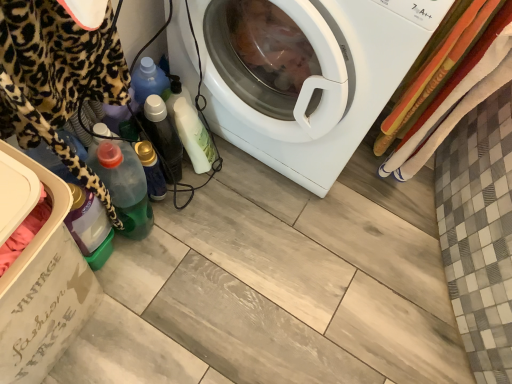
Question: Does translucent plastic bottle at lower left, arranged as the third bottle when viewed from the top, have a smaller size compared to transparent plastic dish washer at lower left?

Choices:
 (A) no
 (B) yes

Answer: (B)

Question: Can you confirm if translucent plastic bottle at lower left, which is the first bottle in bottom-to-top order, is shorter than transparent plastic dish washer at lower left?

Choices:
 (A) no
 (B) yes

Answer: (B)

Question: Is translucent plastic bottle at lower left, arranged as the third bottle when viewed from the top, facing away from transparent plastic dish washer at lower left?

Choices:
 (A) yes
 (B) no

Answer: (A)

Question: From a real-world perspective, is translucent plastic bottle at lower left, which is the first bottle in bottom-to-top order, on top of transparent plastic dish washer at lower left?

Choices:
 (A) yes
 (B) no

Answer: (B)

Question: Considering the relative positions of translucent plastic bottle at lower left, which is the first bottle in bottom-to-top order, and transparent plastic dish washer at lower left in the image provided, is translucent plastic bottle at lower left, which is the first bottle in bottom-to-top order, behind transparent plastic dish washer at lower left?

Choices:
 (A) yes
 (B) no

Answer: (A)

Question: In the image, is translucent plastic bottle at lower left, arranged as the third bottle when viewed from the top, positioned in front of or behind white glossy bottle at center, placed as the 1th bottle when sorted from top to bottom?

Choices:
 (A) behind
 (B) front

Answer: (B)

Question: Would you say translucent plastic bottle at lower left, arranged as the third bottle when viewed from the top, is inside or outside white glossy bottle at center, placed as the 1th bottle when sorted from top to bottom?

Choices:
 (A) outside
 (B) inside

Answer: (A)

Question: Considering the relative positions of translucent plastic bottle at lower left, which is the first bottle in bottom-to-top order, and white glossy bottle at center, placed as the 1th bottle when sorted from top to bottom, in the image provided, is translucent plastic bottle at lower left, which is the first bottle in bottom-to-top order, to the left or to the right of white glossy bottle at center, placed as the 1th bottle when sorted from top to bottom,?

Choices:
 (A) right
 (B) left

Answer: (B)

Question: From the image's perspective, is translucent plastic bottle at lower left, arranged as the third bottle when viewed from the top, positioned above or below white glossy bottle at center, which appears as the third bottle when ordered from the bottom?

Choices:
 (A) above
 (B) below

Answer: (B)

Question: Do you think white glossy bottle at center, placed as the 1th bottle when sorted from top to bottom, is within translucent plastic bottle at center, marked as the second bottle in a bottom-to-top arrangement, or outside of it?

Choices:
 (A) outside
 (B) inside

Answer: (A)

Question: Is point (163, 137) positioned closer to the camera than point (154, 177)?

Choices:
 (A) farther
 (B) closer

Answer: (B)

Question: Looking at their shapes, would you say white glossy bottle at center, which appears as the third bottle when ordered from the bottom, is wider or thinner than translucent plastic bottle at center, marked as the second bottle in a bottom-to-top arrangement?

Choices:
 (A) wide
 (B) thin

Answer: (A)

Question: Considering the positions of white glossy bottle at center, which appears as the third bottle when ordered from the bottom, and translucent plastic bottle at center, marked as the second bottle in a bottom-to-top arrangement, in the image, is white glossy bottle at center, which appears as the third bottle when ordered from the bottom, bigger or smaller than translucent plastic bottle at center, marked as the second bottle in a bottom-to-top arrangement,?

Choices:
 (A) big
 (B) small

Answer: (A)

Question: From a real-world perspective, is white glossy bottle at center, placed as the 1th bottle when sorted from top to bottom, physically located above or below translucent plastic bottle at lower left, arranged as the third bottle when viewed from the top?

Choices:
 (A) below
 (B) above

Answer: (A)

Question: Considering the positions of white glossy bottle at center, placed as the 1th bottle when sorted from top to bottom, and translucent plastic bottle at lower left, which is the first bottle in bottom-to-top order, in the image, is white glossy bottle at center, placed as the 1th bottle when sorted from top to bottom, wider or thinner than translucent plastic bottle at lower left, which is the first bottle in bottom-to-top order,?

Choices:
 (A) wide
 (B) thin

Answer: (B)